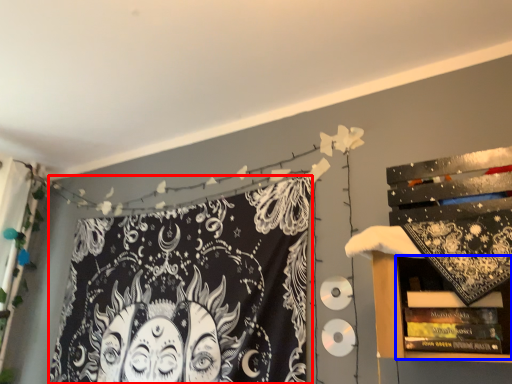
Question: Which point is closer to the camera, fabric (highlighted by a red box) or shelf (highlighted by a blue box)?

Choices:
 (A) fabric
 (B) shelf

Answer: (B)